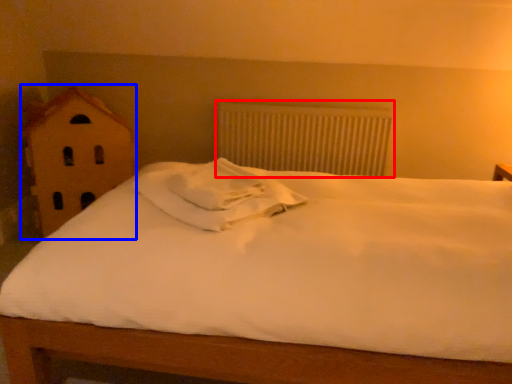
Question: Which object is further to the camera taking this photo, radiator (highlighted by a red box) or toy (highlighted by a blue box)?

Choices:
 (A) radiator
 (B) toy

Answer: (A)